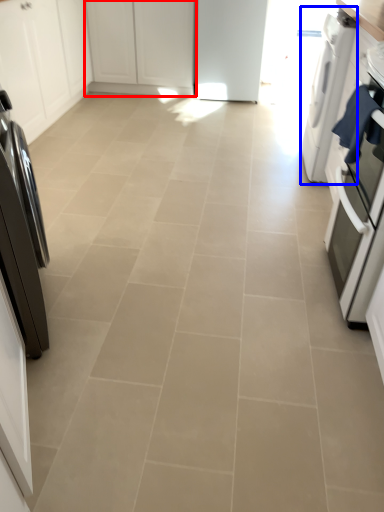
Question: Which point is further to the camera, cabinetry (highlighted by a red box) or home appliance (highlighted by a blue box)?

Choices:
 (A) cabinetry
 (B) home appliance

Answer: (A)